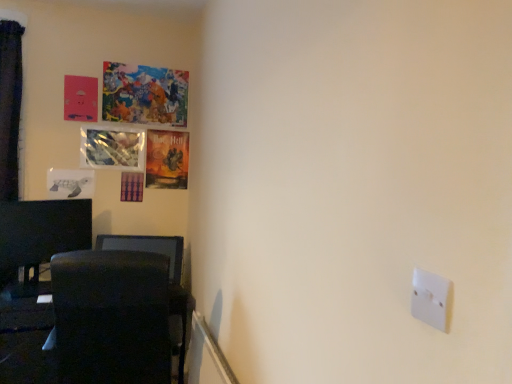
Question: Should I look upward or downward to see velvet dark blue curtain at left?

Choices:
 (A) down
 (B) up

Answer: (B)

Question: Is white paper turtle at left, positioned as the 4th picture frame in top-to-bottom order, in front of black fabric swivel chair at lower left?

Choices:
 (A) yes
 (B) no

Answer: (B)

Question: Could you tell me if white paper turtle at left, positioned as the 4th picture frame in top-to-bottom order, is turned towards black fabric swivel chair at lower left?

Choices:
 (A) yes
 (B) no

Answer: (B)

Question: Does white paper turtle at left, positioned as the 4th picture frame in top-to-bottom order, have a greater width compared to black fabric swivel chair at lower left?

Choices:
 (A) yes
 (B) no

Answer: (B)

Question: Does white paper turtle at left, which ranks as the first picture frame in bottom-to-top order, appear on the right side of black fabric swivel chair at lower left?

Choices:
 (A) no
 (B) yes

Answer: (A)

Question: From the image's perspective, is white paper turtle at left, which ranks as the first picture frame in bottom-to-top order, under black fabric swivel chair at lower left?

Choices:
 (A) yes
 (B) no

Answer: (B)

Question: Considering the relative sizes of white paper turtle at left, which ranks as the first picture frame in bottom-to-top order, and black fabric swivel chair at lower left in the image provided, is white paper turtle at left, which ranks as the first picture frame in bottom-to-top order, smaller than black fabric swivel chair at lower left?

Choices:
 (A) no
 (B) yes

Answer: (B)

Question: Is velvet dark blue curtain at left not inside matte paper poster at upper left, which ranks as the third picture frame in top-to-bottom order?

Choices:
 (A) yes
 (B) no

Answer: (A)

Question: From the image's perspective, is velvet dark blue curtain at left below matte paper poster at upper left, which ranks as the third picture frame in top-to-bottom order?

Choices:
 (A) yes
 (B) no

Answer: (A)

Question: Can you confirm if velvet dark blue curtain at left is bigger than matte paper poster at upper left, which ranks as the third picture frame in top-to-bottom order?

Choices:
 (A) yes
 (B) no

Answer: (A)

Question: Is velvet dark blue curtain at left positioned behind matte paper poster at upper left, which ranks as the third picture frame in top-to-bottom order?

Choices:
 (A) no
 (B) yes

Answer: (A)

Question: Can matte paper poster at upper left, the 2th picture frame when ordered from bottom to top, be found inside velvet dark blue curtain at left?

Choices:
 (A) yes
 (B) no

Answer: (B)

Question: Is velvet dark blue curtain at left aimed at matte paper poster at upper left, the 2th picture frame when ordered from bottom to top?

Choices:
 (A) no
 (B) yes

Answer: (A)

Question: From the image's perspective, would you say matte paper poster at upper left, the 2th picture frame when ordered from bottom to top, is positioned over black glossy monitor at left?

Choices:
 (A) yes
 (B) no

Answer: (A)